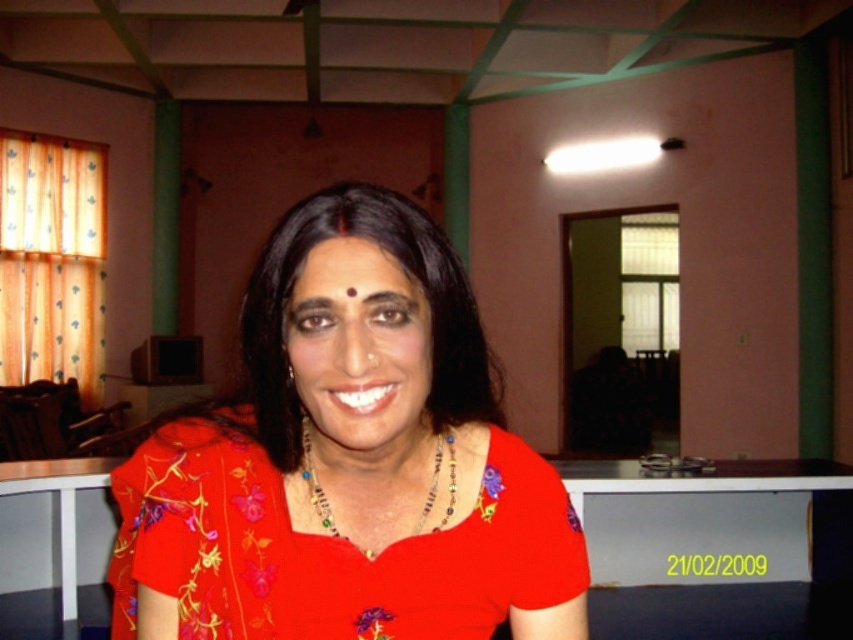
Which is above, matte red forehead at center or beaded necklace at center?

matte red forehead at center is above.

Which is more to the right, matte red forehead at center or beaded necklace at center?

Positioned to the right is beaded necklace at center.

Is point (416, 305) positioned before point (335, 532)?

Yes, it is in front of point (335, 532).

The height and width of the screenshot is (640, 853). Find the location of `matte red forehead at center`. matte red forehead at center is located at coordinates (351, 275).

Does matte floral dress at center appear over matte red forehead at center?

No.

Who is higher up, matte floral dress at center or matte red forehead at center?

matte red forehead at center is higher up.

Measure the distance between point [247,612] and camera.

A distance of 25.41 inches exists between point [247,612] and camera.

In order to click on matte floral dress at center in this screenshot , I will do `click(349, 468)`.

Consider the image. Can you confirm if matte floral dress at center is positioned below beaded necklace at center?

Indeed, matte floral dress at center is positioned under beaded necklace at center.

Is point (560, 486) positioned in front of point (323, 515)?

No, it is behind (323, 515).

I want to click on matte floral dress at center, so click(x=349, y=468).